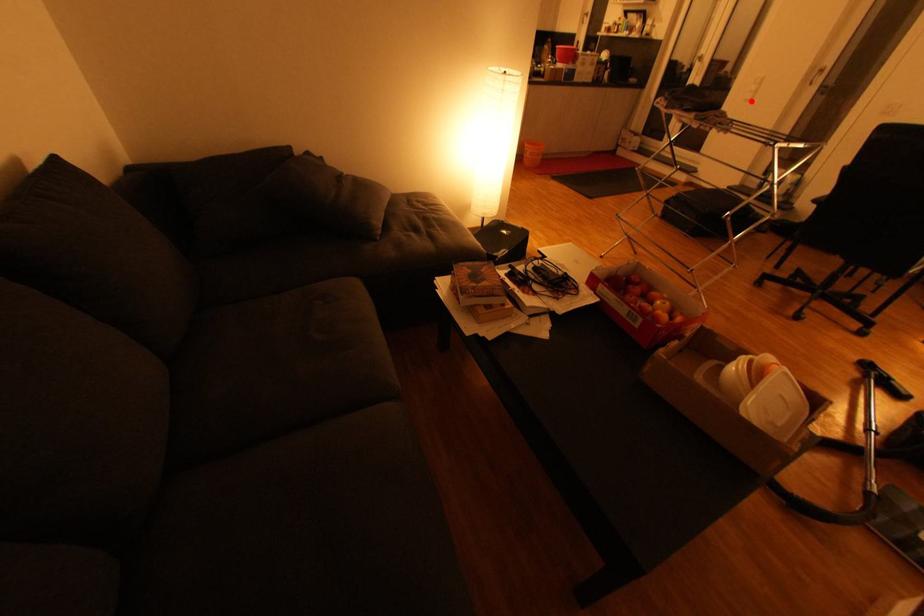
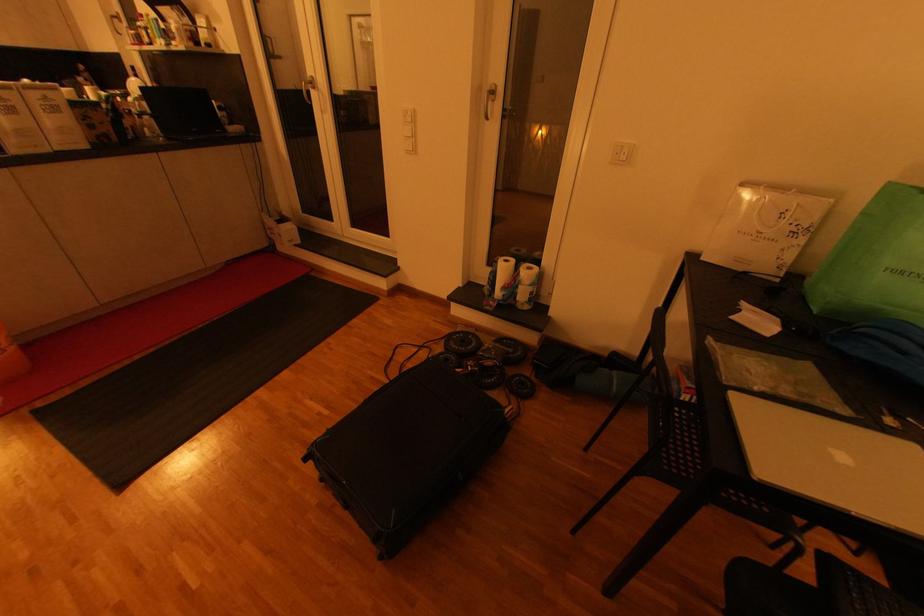
Where in the second image is the point corresponding to the highlighted location from the first image?

(412, 153)